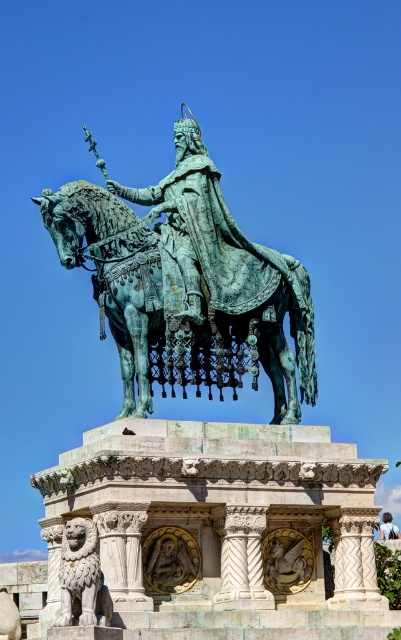
What are the coordinates of the green patina horse at center in the image?

The coordinates of the green patina horse at center are at point (178,320).

You are an art conservator assessing the statue and its surroundings. You notice the green patina horse at center and the stone lion at lower left. Which object would require more material for a protective coating, considering their sizes?

The green patina horse at center is larger in size than the stone lion at lower left, so it would require more material for a protective coating.